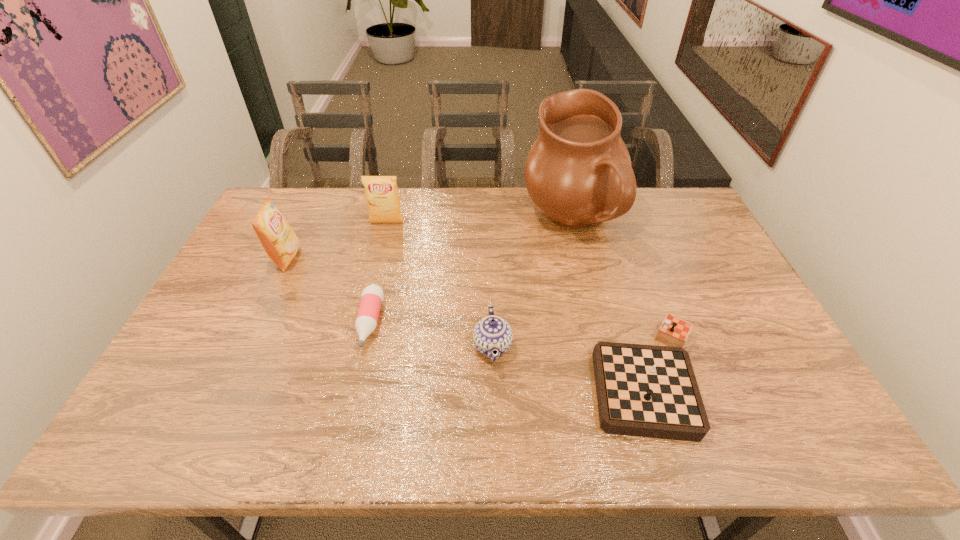
Locate an element on the screen. Image resolution: width=960 pixels, height=540 pixels. cream pitcher is located at coordinates (578, 171).

Locate an element on the screen. This screenshot has width=960, height=540. the leftmost object is located at coordinates (280, 242).

The width and height of the screenshot is (960, 540). I want to click on the left crisp (potato chip), so click(x=280, y=242).

Identify the location of the right crisp (potato chip). (381, 192).

Locate an element on the screen. the third object from right to left is located at coordinates (491, 333).

At what (x,y) coordinates should I click in order to perform the action: click on the third shortest object. Please return your answer as a coordinate pair (x, y). Looking at the image, I should click on click(491, 333).

Where is `chessboard`? The image size is (960, 540). chessboard is located at coordinates (642, 390).

You are a GUI agent. You are given a task and a screenshot of the screen. Output one action in this format:
    pyautogui.click(x=<x>, y=<y>)
    Task: Click on the shortest object
    This screenshot has width=960, height=540.
    Given the screenshot: What is the action you would take?
    pyautogui.click(x=372, y=296)

Find the location of a particular element. free space located at the spout of the cream pitcher is located at coordinates (445, 222).

What are the coordinates of `vacant area situated at the spout of the cream pitcher` in the screenshot? It's located at (451, 222).